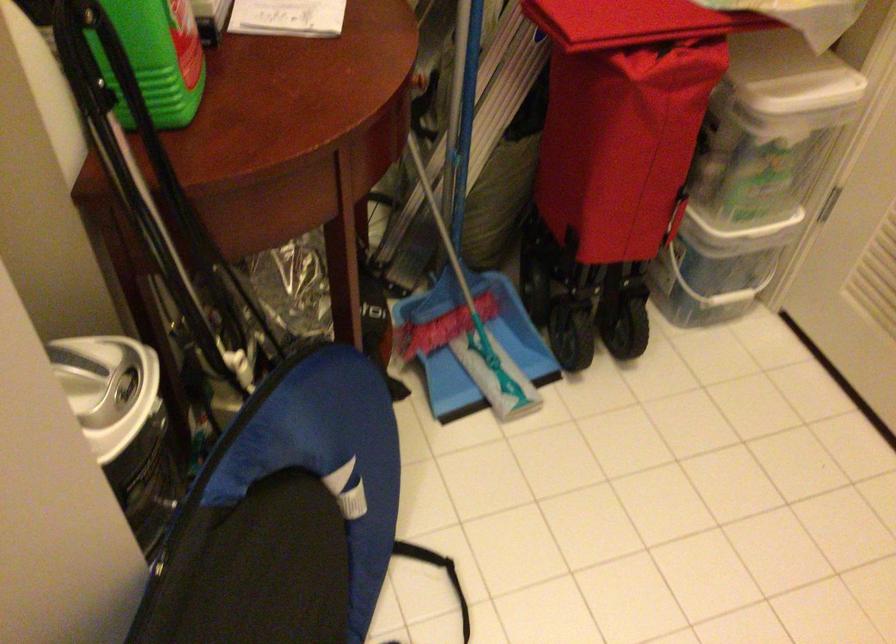
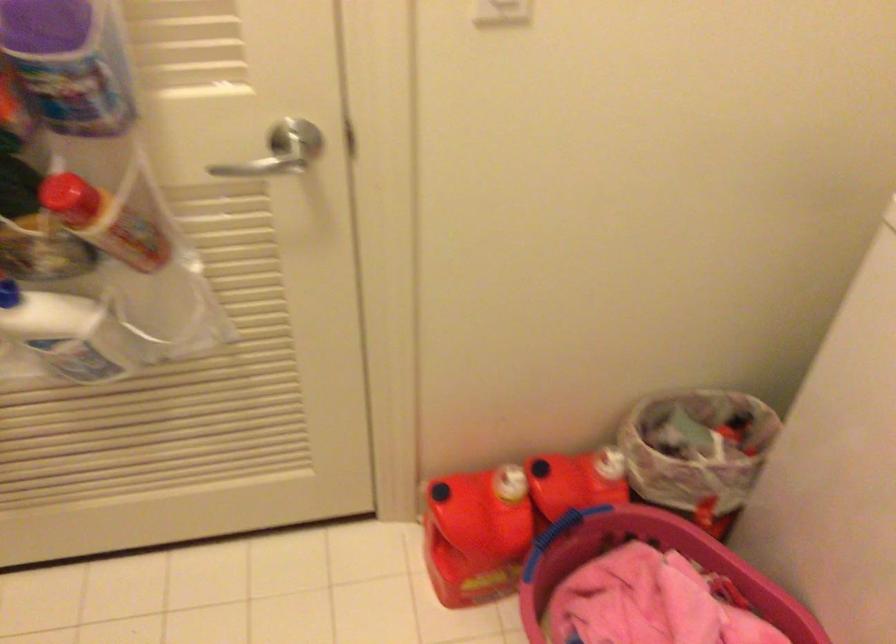
From the picture: How did the camera likely rotate?

The rotation direction of the camera is right-down.